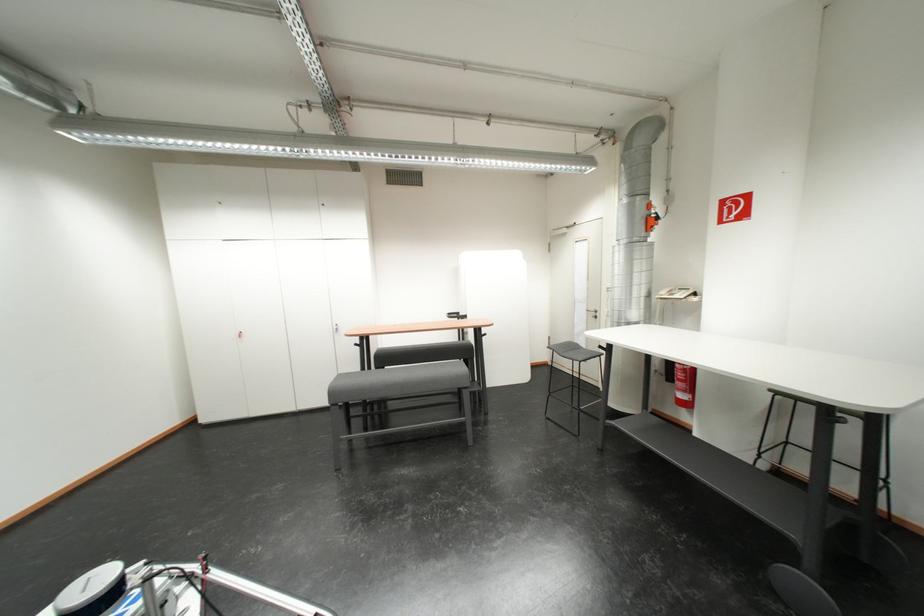
What do you see at coordinates (675, 293) in the screenshot? The width and height of the screenshot is (924, 616). I see `the telephone handset` at bounding box center [675, 293].